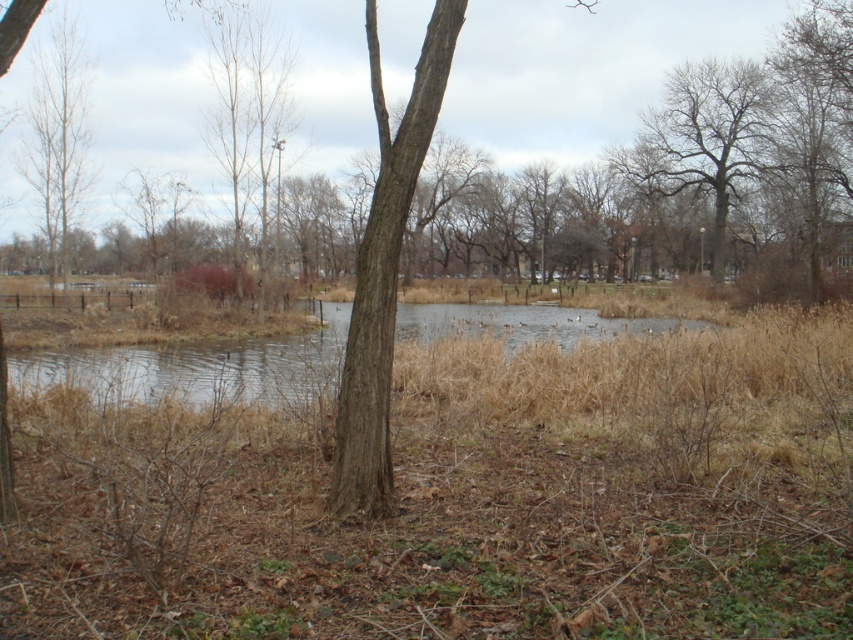
You are a bird looking for a nesting spot. You see the bare branches tree at upper right and the bare wood tree at left. Which tree is positioned higher in the image?

The bare branches tree at upper right is positioned higher in the image than the bare wood tree at left.

You are standing in the natural scene and want to walk from the bare wood tree at left to the bare branches tree at upper right. Which direction should you head towards?

You should head towards the right direction because the bare branches tree at upper right is located to the right of the bare wood tree at left.